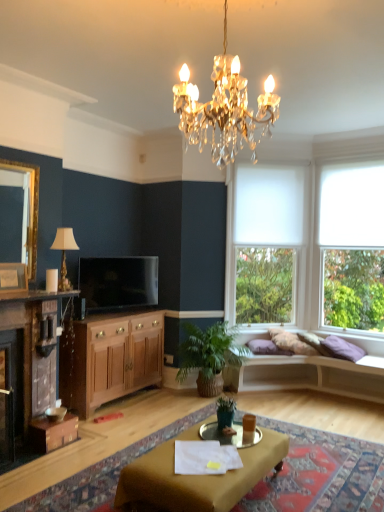
What are the coordinates of `vacant point above clear glass tray at center (from a real-world perspective)` in the screenshot? It's located at (228, 432).